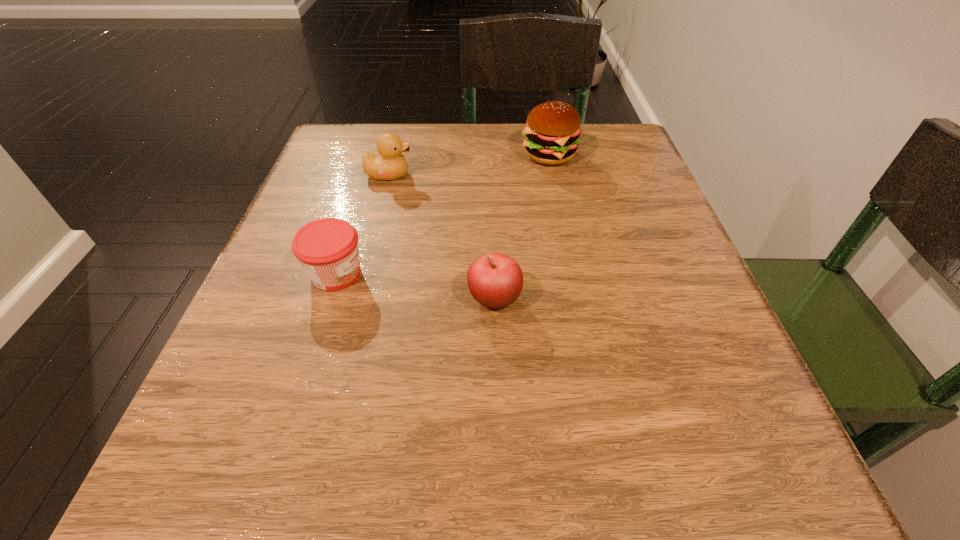
Where is `duckling at the far edge`? The image size is (960, 540). duckling at the far edge is located at coordinates (390, 164).

Locate an element on the screen. duckling present at the left edge is located at coordinates (x=390, y=164).

The width and height of the screenshot is (960, 540). Find the location of `jam situated at the left edge`. jam situated at the left edge is located at coordinates (327, 249).

I want to click on object at the right edge, so click(552, 130).

In order to click on object located at the far left corner in this screenshot , I will do `click(390, 164)`.

Image resolution: width=960 pixels, height=540 pixels. I want to click on object located at the far right corner, so click(552, 130).

In the image, there is a desktop. Identify the location of vacant area at the far edge. The image size is (960, 540). (527, 178).

Locate an element on the screen. free space at the left edge of the desktop is located at coordinates (337, 216).

Image resolution: width=960 pixels, height=540 pixels. In order to click on free space at the right edge in this screenshot , I will do `click(662, 301)`.

At what (x,y) coordinates should I click in order to perform the action: click on free location at the near left corner. Please return your answer as a coordinate pair (x, y). Image resolution: width=960 pixels, height=540 pixels. Looking at the image, I should click on (231, 446).